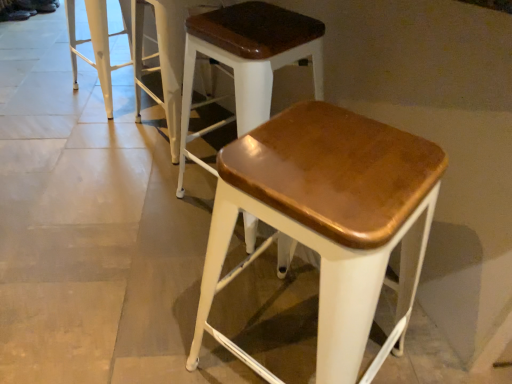
Question: Considering the relative sizes of white metal stool at upper left, which is the first stool in left-to-right order, and matte brown wood stool at center, which ranks as the second stool in right-to-left order, in the image provided, is white metal stool at upper left, which is the first stool in left-to-right order, shorter than matte brown wood stool at center, which ranks as the second stool in right-to-left order,?

Choices:
 (A) yes
 (B) no

Answer: (A)

Question: Is white metal stool at upper left, which is counted as the 4th stool, starting from the right, smaller than matte brown wood stool at center, the 3th stool positioned from the left?

Choices:
 (A) yes
 (B) no

Answer: (A)

Question: Would you consider white metal stool at upper left, which is counted as the 4th stool, starting from the right, to be distant from matte brown wood stool at center, which ranks as the second stool in right-to-left order?

Choices:
 (A) no
 (B) yes

Answer: (A)

Question: Does white metal stool at upper left, which is the first stool in left-to-right order, have a greater height compared to matte brown wood stool at center, which ranks as the second stool in right-to-left order?

Choices:
 (A) no
 (B) yes

Answer: (A)

Question: Could matte brown wood stool at center, the 3th stool positioned from the left, be considered to be inside white metal stool at upper left, which is counted as the 4th stool, starting from the right?

Choices:
 (A) no
 (B) yes

Answer: (A)

Question: Is white metal stool at upper left, which is the first stool in left-to-right order, in front of or behind wooden seat stool at center, the third stool from the right, in the image?

Choices:
 (A) behind
 (B) front

Answer: (A)

Question: Is white metal stool at upper left, which is the first stool in left-to-right order, to the left or to the right of wooden seat stool at center, the second stool in the left-to-right sequence, in the image?

Choices:
 (A) right
 (B) left

Answer: (B)

Question: From the image's perspective, relative to wooden seat stool at center, the third stool from the right, is white metal stool at upper left, which is the first stool in left-to-right order, above or below?

Choices:
 (A) above
 (B) below

Answer: (A)

Question: From a real-world perspective, is white metal stool at upper left, which is counted as the 4th stool, starting from the right, positioned above or below wooden seat stool at center, the third stool from the right?

Choices:
 (A) above
 (B) below

Answer: (B)

Question: Is matte brown wood stool at center, which ranks as the 4th stool in left-to-right order, wider or thinner than white metal stool at upper left, which is the first stool in left-to-right order?

Choices:
 (A) thin
 (B) wide

Answer: (B)

Question: From the image's perspective, relative to white metal stool at upper left, which is counted as the 4th stool, starting from the right, is matte brown wood stool at center, which ranks as the 4th stool in left-to-right order, above or below?

Choices:
 (A) above
 (B) below

Answer: (B)

Question: In the image, is matte brown wood stool at center, marked as the 1th stool in a right-to-left arrangement, on the left side or the right side of white metal stool at upper left, which is the first stool in left-to-right order?

Choices:
 (A) right
 (B) left

Answer: (A)

Question: From a real-world perspective, is matte brown wood stool at center, marked as the 1th stool in a right-to-left arrangement, above or below white metal stool at upper left, which is the first stool in left-to-right order?

Choices:
 (A) below
 (B) above

Answer: (B)

Question: In terms of width, does wooden seat stool at center, the second stool in the left-to-right sequence, look wider or thinner when compared to matte brown wood stool at center, marked as the 1th stool in a right-to-left arrangement?

Choices:
 (A) wide
 (B) thin

Answer: (B)

Question: Is wooden seat stool at center, the third stool from the right, to the left or to the right of matte brown wood stool at center, which ranks as the 4th stool in left-to-right order, in the image?

Choices:
 (A) left
 (B) right

Answer: (A)